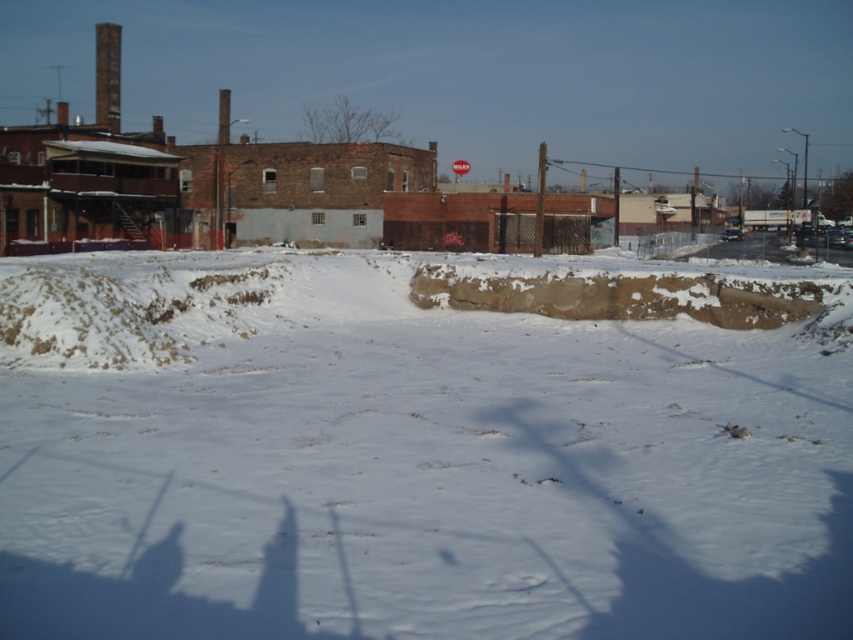
You are standing at the point with coordinates point (x=809, y=307) and want to walk to the point with coordinates point (x=416, y=360). Which direction should you move relative to the other point?

You should move towards the point (x=416, y=360), which is in front of point (x=809, y=307).

You are a delivery person trying to navigate through the snow to reach the buildings. The white powdery snow at center and the brown dirt mound at center are in your path. Which one is located to the left of the other?

The white powdery snow at center is to the left of brown dirt mound at center.

You are a city planner reviewing this urban winter scene. You need to place a new small tree exactly at the center of the image. Is the brown dirt mound at center in the way of this placement?

The brown dirt mound at center is located at point (624,294), which is very close to the center of the image. Therefore, the brown dirt mound at center would likely be in the way of placing the new small tree exactly at the center.